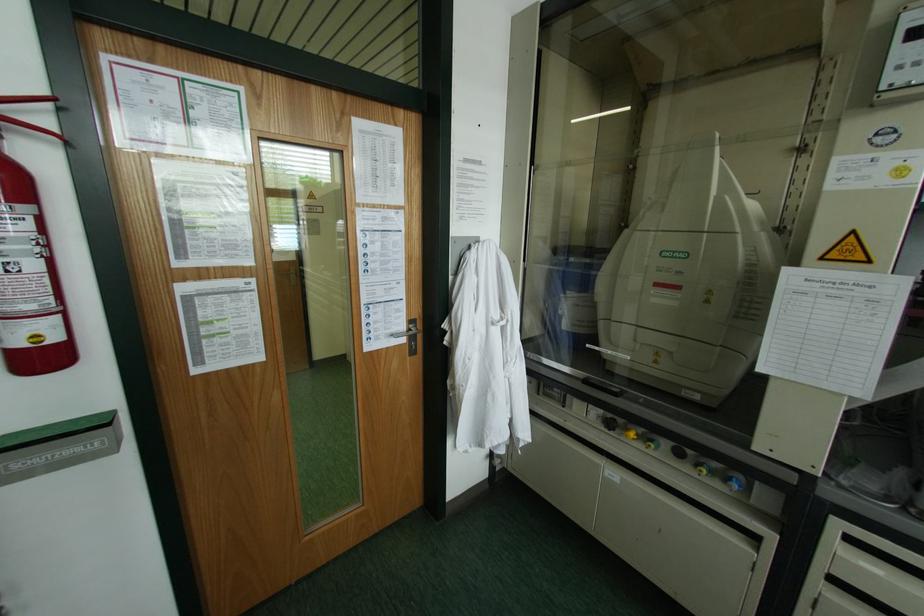
Find the location of a particular element. The height and width of the screenshot is (616, 924). cabinet door handle is located at coordinates (798, 148).